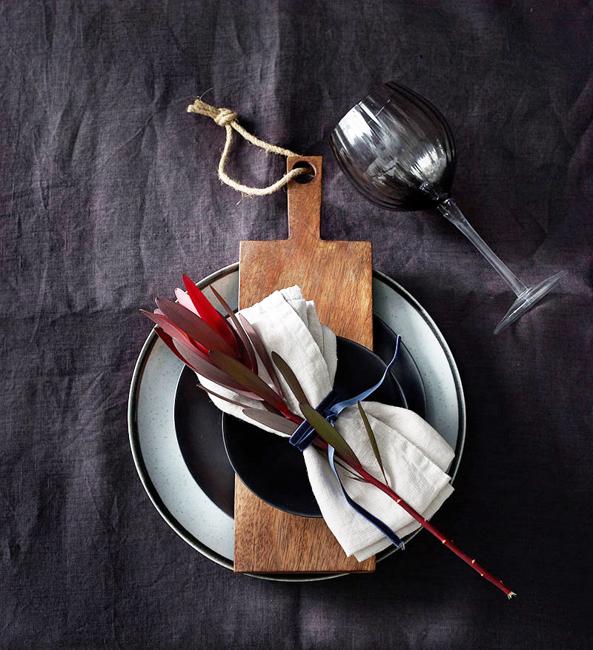
This screenshot has height=650, width=593. I want to click on small black plate, so click(x=390, y=398).